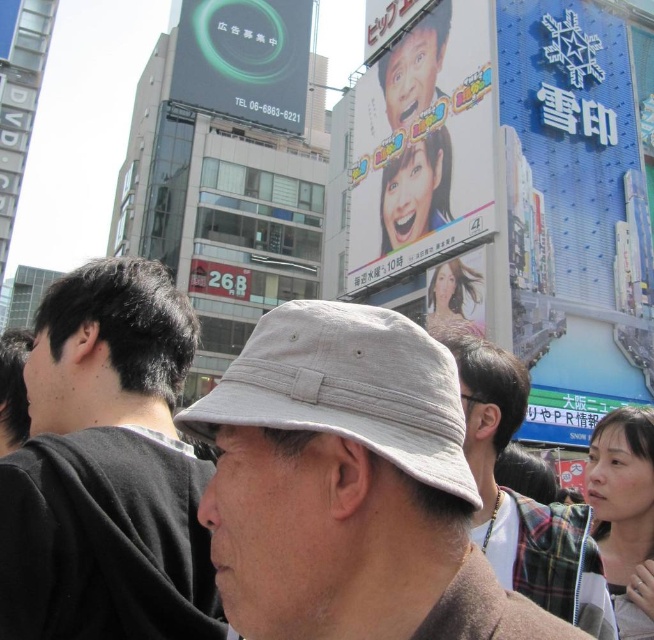
Question: Is dark gray/black hair at left above green glossy billboard at upper left?

Choices:
 (A) no
 (B) yes

Answer: (A)

Question: Is blue glossy sign at upper right bigger than light beige fabric baseball hat at center?

Choices:
 (A) no
 (B) yes

Answer: (B)

Question: Which point is closer to the camera?

Choices:
 (A) blue glossy sign at upper right
 (B) dark brown hair at left
 (C) dark gray/black hair at left

Answer: (C)

Question: Can you confirm if matte plastic billboard at center is bigger than green glossy billboard at upper left?

Choices:
 (A) yes
 (B) no

Answer: (A)

Question: Which point is farther to the camera?

Choices:
 (A) light gray fabric hat at center
 (B) light beige fabric hat at center
 (C) matte red sign at center
 (D) dark gray/black hair at left

Answer: (C)

Question: Which point is farther to the camera?

Choices:
 (A) (443, 28)
 (B) (438, 499)
 (C) (220, 278)

Answer: (C)